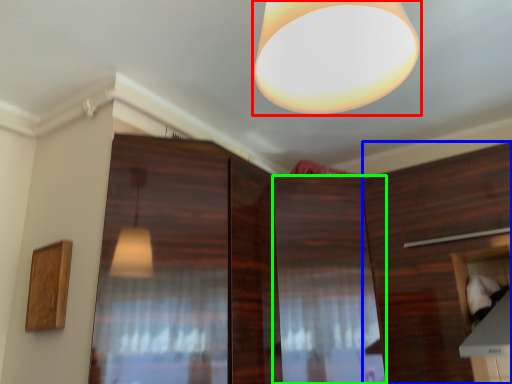
Question: Estimate the real-world distances between objects in this image. Which object is closer to lamp (highlighted by a red box), cabinetry (highlighted by a blue box) or cabinetry (highlighted by a green box)?

Choices:
 (A) cabinetry
 (B) cabinetry

Answer: (B)